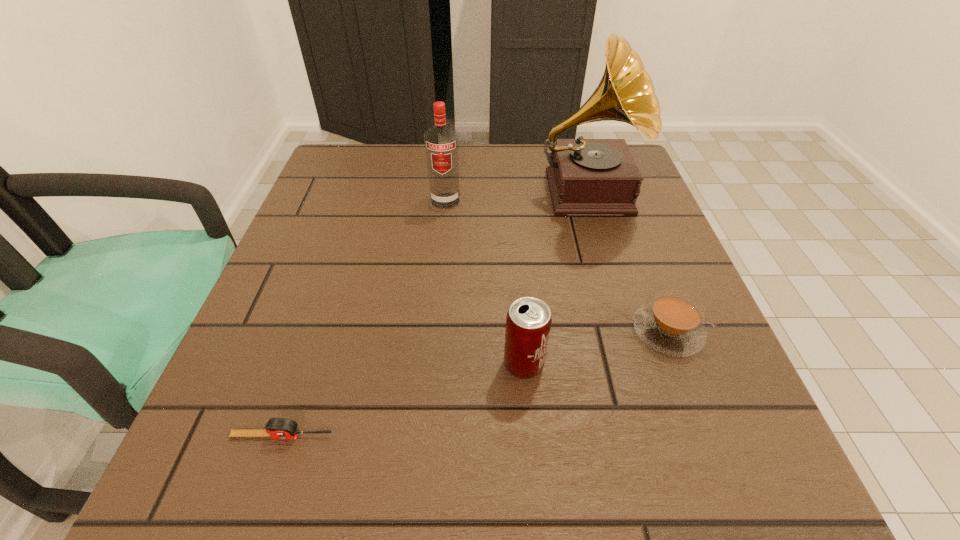
Locate an element on the screen. This screenshot has width=960, height=540. the tallest object is located at coordinates 586,176.

At what (x,y) coordinates should I click in order to perform the action: click on vodka. Please return your answer as a coordinate pair (x, y). This screenshot has width=960, height=540. Looking at the image, I should click on (441, 142).

Locate an element on the screen. the fourth shortest object is located at coordinates (441, 142).

I want to click on the third shortest object, so [x=528, y=322].

Image resolution: width=960 pixels, height=540 pixels. In order to click on the third object from left to right in this screenshot , I will do `click(528, 322)`.

Locate an element on the screen. The width and height of the screenshot is (960, 540). the second shortest object is located at coordinates (672, 324).

You are a GUI agent. You are given a task and a screenshot of the screen. Output one action in this format:
    pyautogui.click(x=<x>, y=<y>)
    Task: Click on the nearest object
    This screenshot has width=960, height=540.
    Given the screenshot: What is the action you would take?
    pyautogui.click(x=277, y=428)

This screenshot has width=960, height=540. Find the location of `the leftmost object`. the leftmost object is located at coordinates (277, 428).

Where is `vacant region located 0.050m from the horn of the tallest object`? The height and width of the screenshot is (540, 960). vacant region located 0.050m from the horn of the tallest object is located at coordinates [x=604, y=251].

At what (x,y) coordinates should I click in order to perform the action: click on vacant area situated 0.150m on the front label of the fourth object from right to left. Please return your answer as a coordinate pair (x, y). The width and height of the screenshot is (960, 540). Looking at the image, I should click on (440, 255).